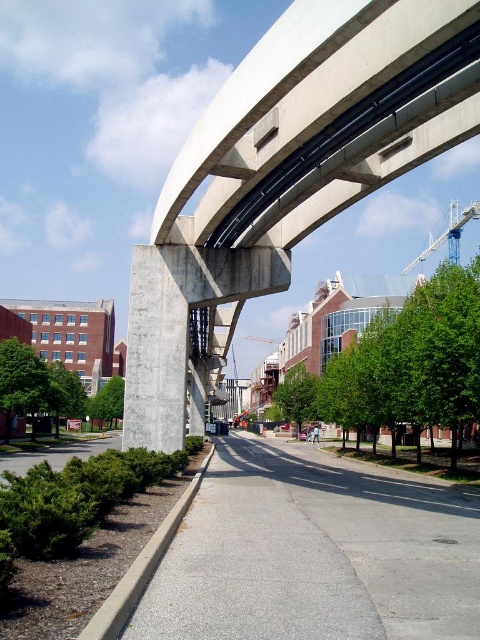
Locate an element on the screen. Image resolution: width=480 pixels, height=640 pixels. concrete/smooth overpass at upper center is located at coordinates (286, 177).

Is point (259, 221) farther from camera compared to point (429, 244)?

No, (259, 221) is in front of (429, 244).

Identify the location of concrete/smooth overpass at upper center. (286, 177).

In the scene shown: Can you confirm if concrete pillar at center is wider than white metallic crane at upper right?

In fact, concrete pillar at center might be narrower than white metallic crane at upper right.

Consider the image. Who is lower down, concrete pillar at center or white metallic crane at upper right?

concrete pillar at center is lower down.

Where is `concrete pillar at center`? The width and height of the screenshot is (480, 640). concrete pillar at center is located at coordinates (157, 348).

Identify the location of concrete pillar at center. The width and height of the screenshot is (480, 640). (157, 348).

Can you confirm if concrete/smooth overpass at upper center is wider than concrete pillar at center?

Indeed, concrete/smooth overpass at upper center has a greater width compared to concrete pillar at center.

Is point (396, 35) farther from viewer compared to point (181, 422)?

No, it is not.

Locate an element on the screen. The height and width of the screenshot is (640, 480). concrete/smooth overpass at upper center is located at coordinates coord(286,177).